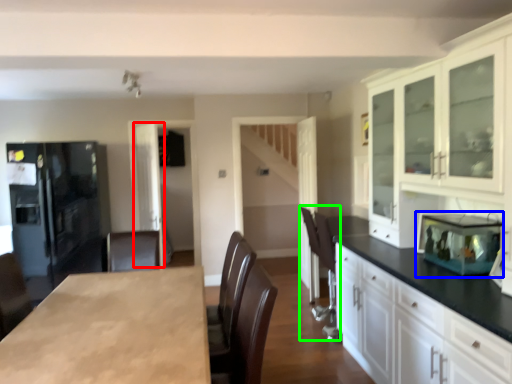
Question: Which object is the farthest from glass door (highlighted by a red box)? Choose among these: appliance (highlighted by a blue box) or armchair (highlighted by a green box).

Choices:
 (A) appliance
 (B) armchair

Answer: (A)